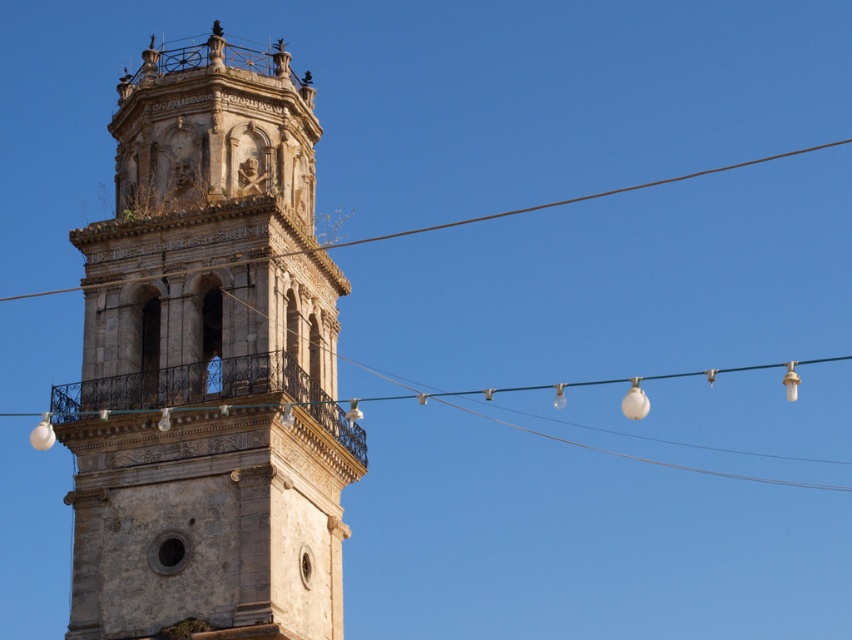
You are standing in front of the stone tower and notice two wires. The brown wire at upper center and the green wire at center are both holding lights. Which wire is closer to you?

The brown wire at upper center is closer to you because it is further to the viewer than the green wire at center.

You are standing in front of the tower and notice a point marked at coordinates (562, 200). What object does this point correspond to in the scene?

The point at coordinates (562, 200) corresponds to the brown wire at upper center.